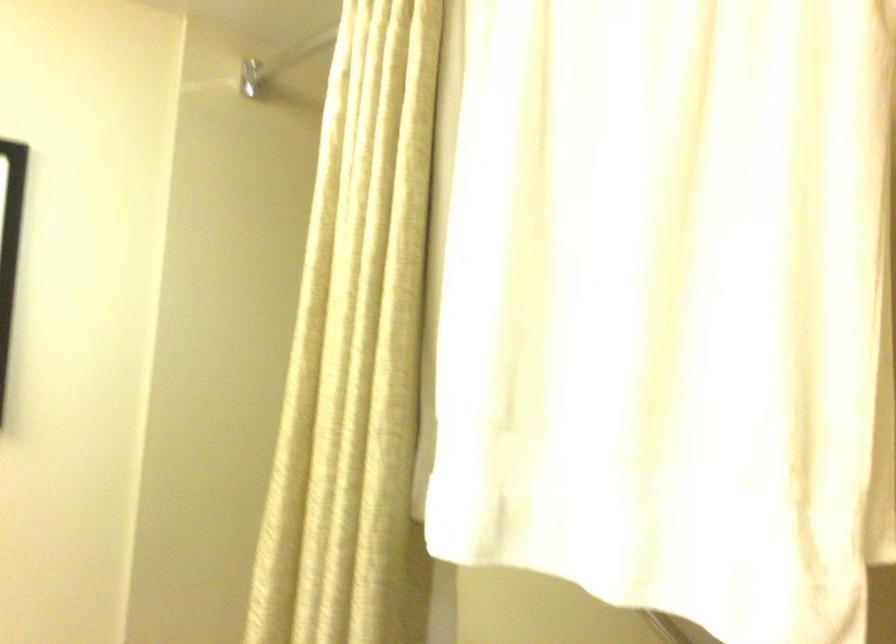
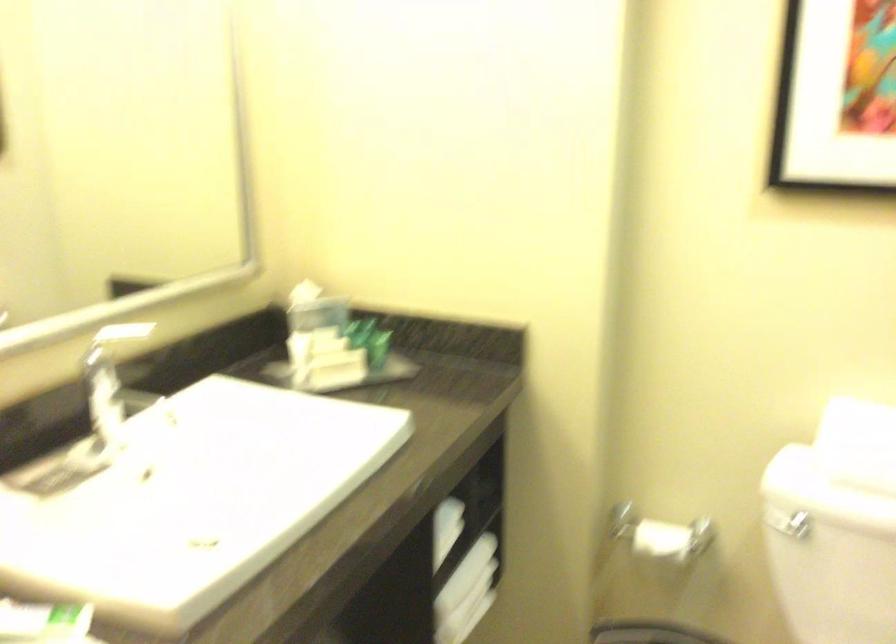
Question: The images are taken continuously from a first-person perspective. In which direction is your viewpoint rotating?

Choices:
 (A) Left
 (B) Right
 (C) Up
 (D) Down

Answer: (A)